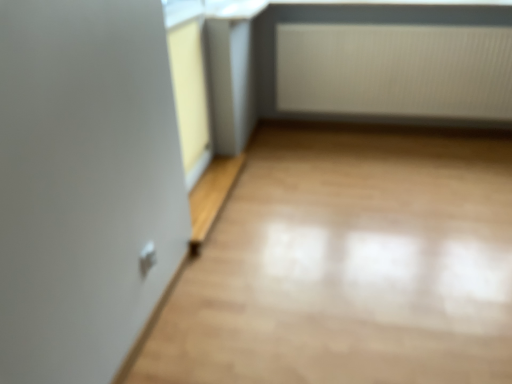
Identify the location of free space above white textured radiator at upper right (from a real-world perspective). The width and height of the screenshot is (512, 384). (406, 24).